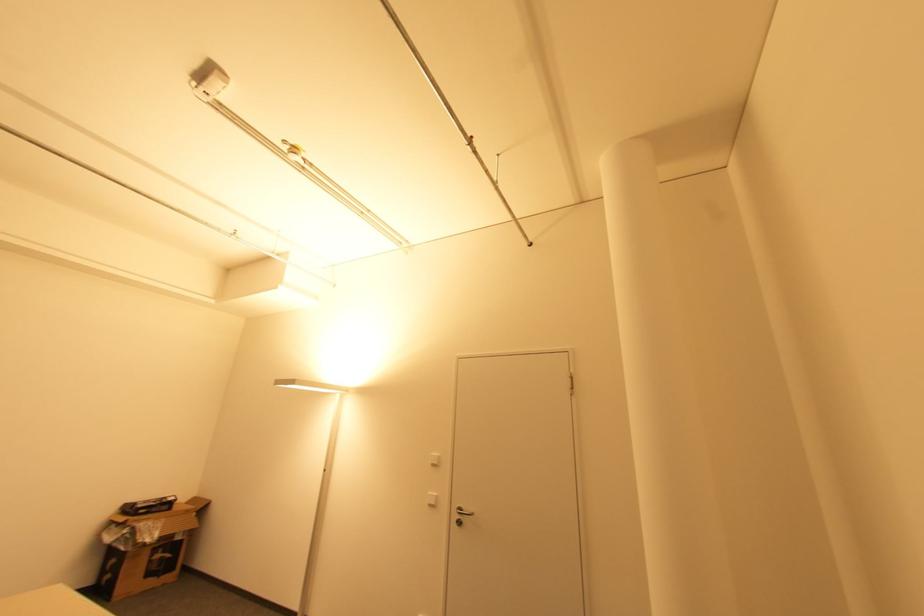
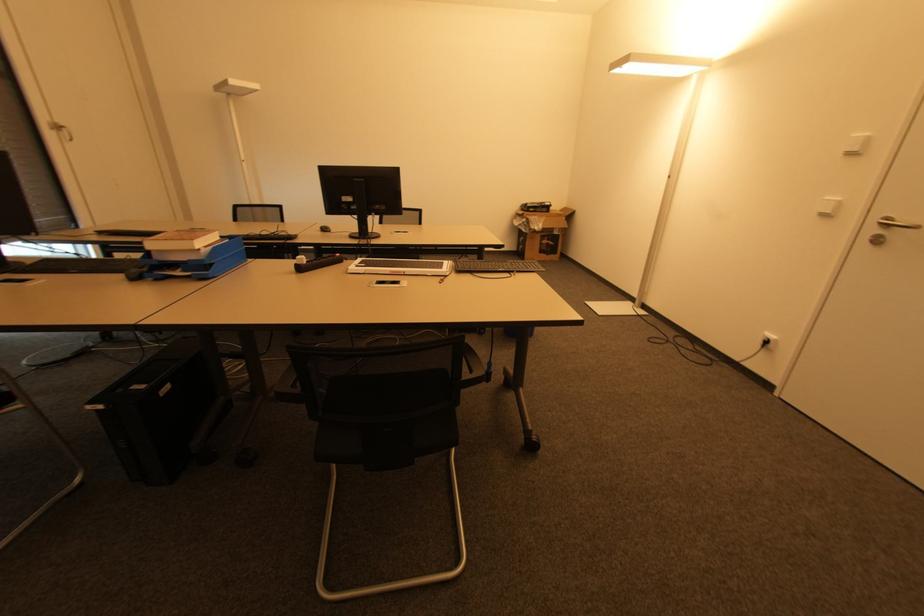
Where in the second image is the point corresponding to the point at 164,559 from the first image?

(550, 245)